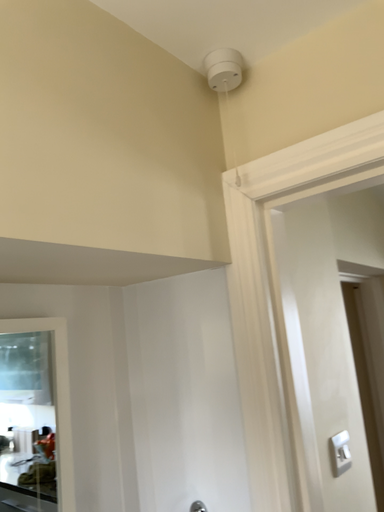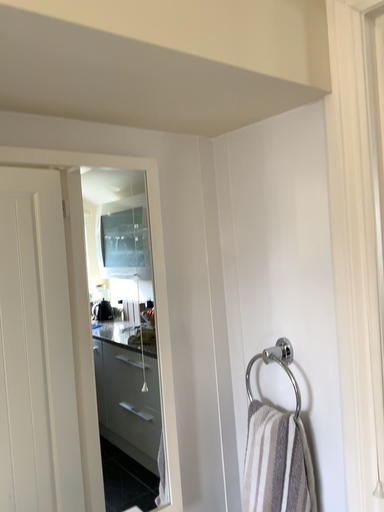
Question: How did the camera likely rotate when shooting the video?

Choices:
 (A) rotated downward
 (B) rotated upward

Answer: (A)